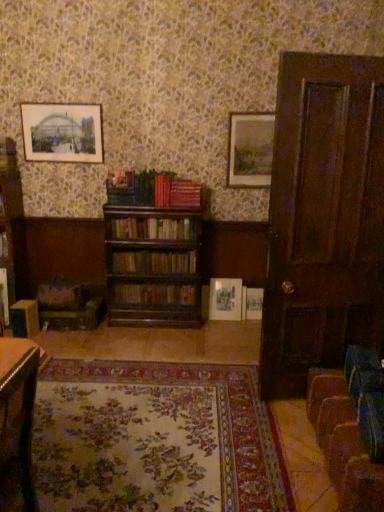
Question: Would you say wooden bookshelf at center, the third book positioned from the bottom, is outside brown wooden bookcase at left?

Choices:
 (A) yes
 (B) no

Answer: (A)

Question: From a real-world perspective, is wooden bookshelf at center, which appears as the 2th book when viewed from the top, on brown wooden bookcase at left?

Choices:
 (A) no
 (B) yes

Answer: (B)

Question: Considering the relative sizes of wooden bookshelf at center, which appears as the 2th book when viewed from the top, and brown wooden bookcase at left in the image provided, is wooden bookshelf at center, which appears as the 2th book when viewed from the top, shorter than brown wooden bookcase at left?

Choices:
 (A) yes
 (B) no

Answer: (A)

Question: Is wooden bookshelf at center, which appears as the 2th book when viewed from the top, oriented towards brown wooden bookcase at left?

Choices:
 (A) yes
 (B) no

Answer: (B)

Question: Does wooden bookshelf at center, which appears as the 2th book when viewed from the top, have a smaller size compared to brown wooden bookcase at left?

Choices:
 (A) yes
 (B) no

Answer: (A)

Question: Is wooden bookshelf at center, the third book positioned from the bottom, oriented away from brown wooden bookcase at left?

Choices:
 (A) no
 (B) yes

Answer: (A)

Question: Does wooden bookshelf at center, which appears as the 2th book when viewed from the top, appear on the left side of wooden table at lower left?

Choices:
 (A) no
 (B) yes

Answer: (A)

Question: Can you confirm if wooden bookshelf at center, which appears as the 2th book when viewed from the top, is smaller than wooden table at lower left?

Choices:
 (A) no
 (B) yes

Answer: (B)

Question: Can we say wooden bookshelf at center, which appears as the 2th book when viewed from the top, lies outside wooden table at lower left?

Choices:
 (A) no
 (B) yes

Answer: (B)

Question: From the image's perspective, does wooden bookshelf at center, the third book positioned from the bottom, appear lower than wooden table at lower left?

Choices:
 (A) yes
 (B) no

Answer: (B)

Question: Is wooden bookshelf at center, which appears as the 2th book when viewed from the top, turned away from wooden table at lower left?

Choices:
 (A) no
 (B) yes

Answer: (A)

Question: Is wooden bookshelf at center, which appears as the 2th book when viewed from the top, at the right side of wooden table at lower left?

Choices:
 (A) no
 (B) yes

Answer: (B)

Question: Is matte gold picture frame at center, which is the third picture frame in right-to-left order, located outside wooden swivel chair at lower left, the second swivel chair in the right-to-left sequence?

Choices:
 (A) no
 (B) yes

Answer: (B)